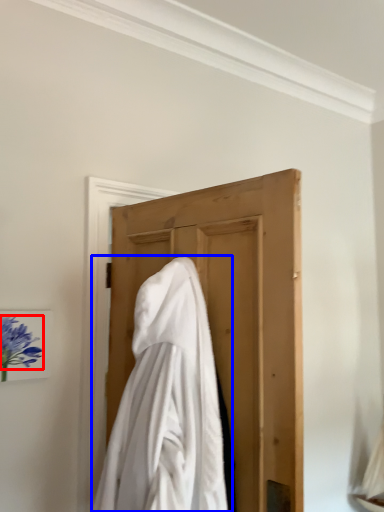
Question: Which of the following is the farthest to the observer, flower (highlighted by a red box) or cloak (highlighted by a blue box)?

Choices:
 (A) flower
 (B) cloak

Answer: (A)